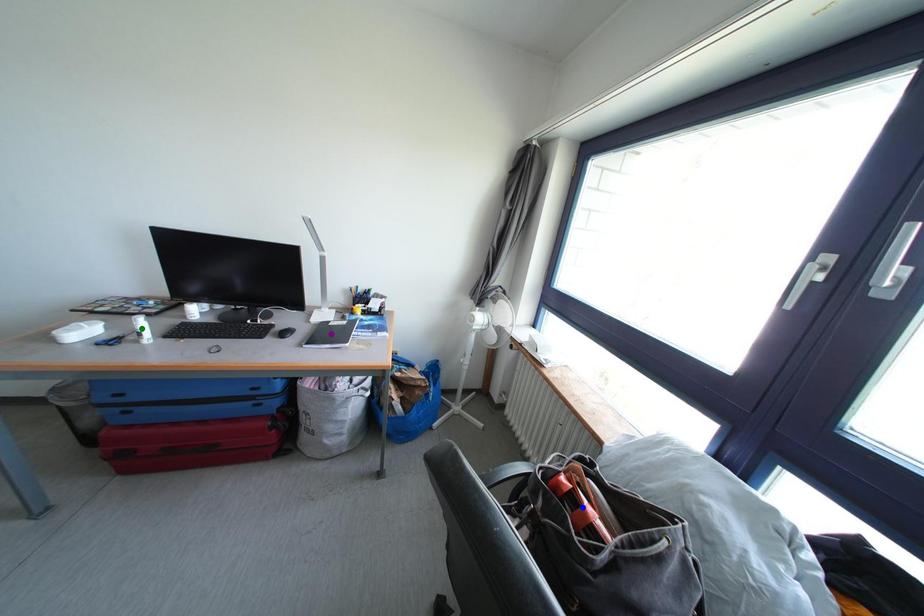
Order these from nearest to farthest:
green point | blue point | purple point

1. blue point
2. green point
3. purple point